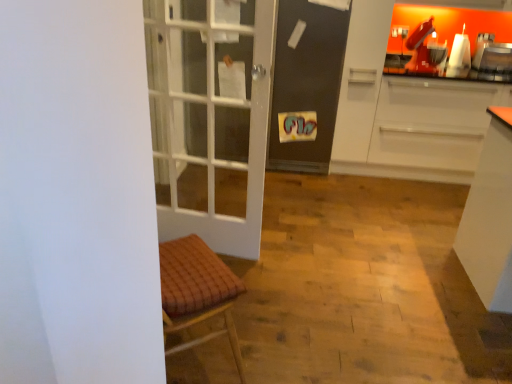
Question: Is point (347, 54) closer or farther from the camera than point (311, 170)?

Choices:
 (A) farther
 (B) closer

Answer: (B)

Question: Is white matte cabinet at right taller or shorter than matte black screen door at center?

Choices:
 (A) tall
 (B) short

Answer: (A)

Question: Which object is positioned farthest from the matte black screen door at center?

Choices:
 (A) metallic silver toaster at upper right
 (B) white matte cabinet at right

Answer: (A)

Question: Which is nearer to the matte black screen door at center?

Choices:
 (A) white matte cabinet at right
 (B) metallic silver toaster at upper right

Answer: (A)